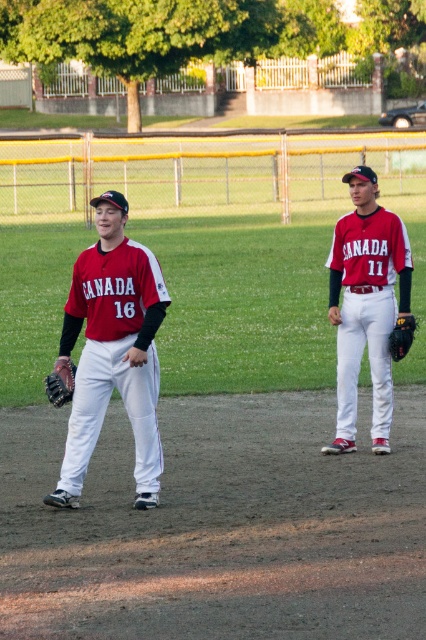
Consider the image. You are standing on the baseball field and want to throw a ball to the point marked at coordinates point (120, 356). Considering the distance, can you reach it with a single throw if your maximum throwing distance is 30 feet?

The point (120, 356) is 29.32 feet away from the viewer, so yes, you can reach it with a single throw since your maximum throwing distance is 30 feet.

You are a photographer standing at the edge of the baseball field. You want to take a photo of the matte red baseball uniform at center and the brown leather glove at left. The camera you are using has a minimum focus distance of 20 inches. Will you be able to capture both subjects clearly in the photo?

The matte red baseball uniform at center is 19.60 inches from the brown leather glove at left. Since the distance between them is less than the camera minimum focus distance of 20 inches, you will not be able to capture both subjects clearly in the photo.

You are a photographer standing behind the two players. You want to take a photo that includes both the matte red jersey at left and the brown leather glove at left. Which object should you focus on first if you want to ensure both are fully visible in the frame?

The matte red jersey at left has a larger width than the brown leather glove at left, so focusing on the matte red jersey at left first will help ensure both objects fit within the frame.